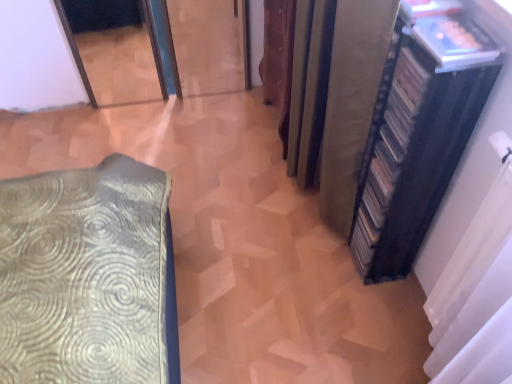
Question: Does black matte bookshelf at right contain black matte curtain at right, which appears as the first curtain when viewed from the right?

Choices:
 (A) yes
 (B) no

Answer: (B)

Question: Is black matte bookshelf at right positioned in front of black matte curtain at right, which ranks as the second curtain in left-to-right order?

Choices:
 (A) yes
 (B) no

Answer: (B)

Question: Does black matte bookshelf at right lie behind black matte curtain at right, which appears as the first curtain when viewed from the right?

Choices:
 (A) yes
 (B) no

Answer: (A)

Question: Is black matte bookshelf at right to the left of black matte curtain at right, which appears as the first curtain when viewed from the right, from the viewer's perspective?

Choices:
 (A) no
 (B) yes

Answer: (B)

Question: Is black matte bookshelf at right not near black matte curtain at right, which appears as the first curtain when viewed from the right?

Choices:
 (A) no
 (B) yes

Answer: (A)

Question: Is silky beige curtain at right, placed as the 2th curtain when sorted from right to left, wider or thinner than translucent plastic book at upper right?

Choices:
 (A) thin
 (B) wide

Answer: (B)

Question: Would you say silky beige curtain at right, placed as the 2th curtain when sorted from right to left, is to the left or to the right of translucent plastic book at upper right in the picture?

Choices:
 (A) right
 (B) left

Answer: (B)

Question: From the image's perspective, relative to translucent plastic book at upper right, is silky beige curtain at right, marked as the first curtain in a left-to-right arrangement, above or below?

Choices:
 (A) below
 (B) above

Answer: (A)

Question: Do you think silky beige curtain at right, placed as the 2th curtain when sorted from right to left, is within translucent plastic book at upper right, or outside of it?

Choices:
 (A) outside
 (B) inside

Answer: (A)

Question: Would you say black matte bookshelf at right is inside or outside silky beige curtain at right, marked as the first curtain in a left-to-right arrangement?

Choices:
 (A) inside
 (B) outside

Answer: (B)

Question: From the image's perspective, is black matte bookshelf at right positioned above or below silky beige curtain at right, marked as the first curtain in a left-to-right arrangement?

Choices:
 (A) below
 (B) above

Answer: (A)

Question: Is point click(446, 144) closer or farther from the camera than point click(370, 82)?

Choices:
 (A) closer
 (B) farther

Answer: (A)

Question: Would you say black matte bookshelf at right is to the left or to the right of silky beige curtain at right, placed as the 2th curtain when sorted from right to left, in the picture?

Choices:
 (A) left
 (B) right

Answer: (B)

Question: In terms of size, does black matte bookshelf at right appear bigger or smaller than translucent plastic book at upper right?

Choices:
 (A) small
 (B) big

Answer: (B)

Question: From a real-world perspective, is black matte bookshelf at right above or below translucent plastic book at upper right?

Choices:
 (A) above
 (B) below

Answer: (B)